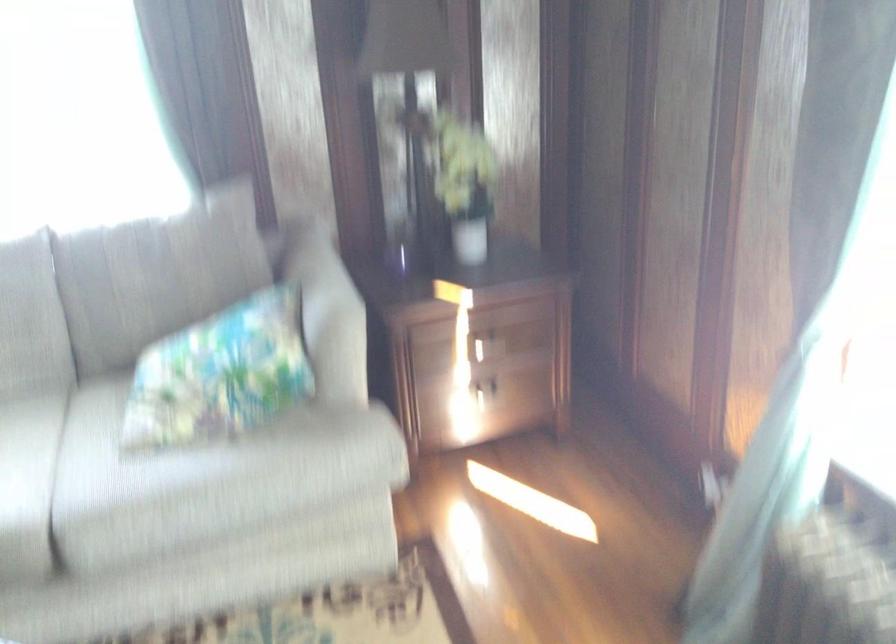
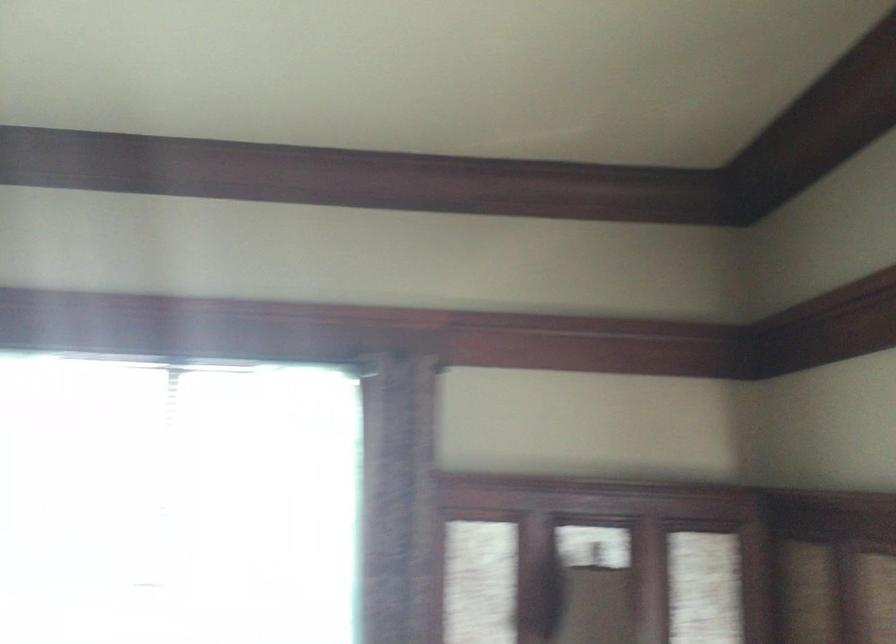
Based on the continuous images, in which direction is the camera rotating?

The rotation direction of the camera is left-up.